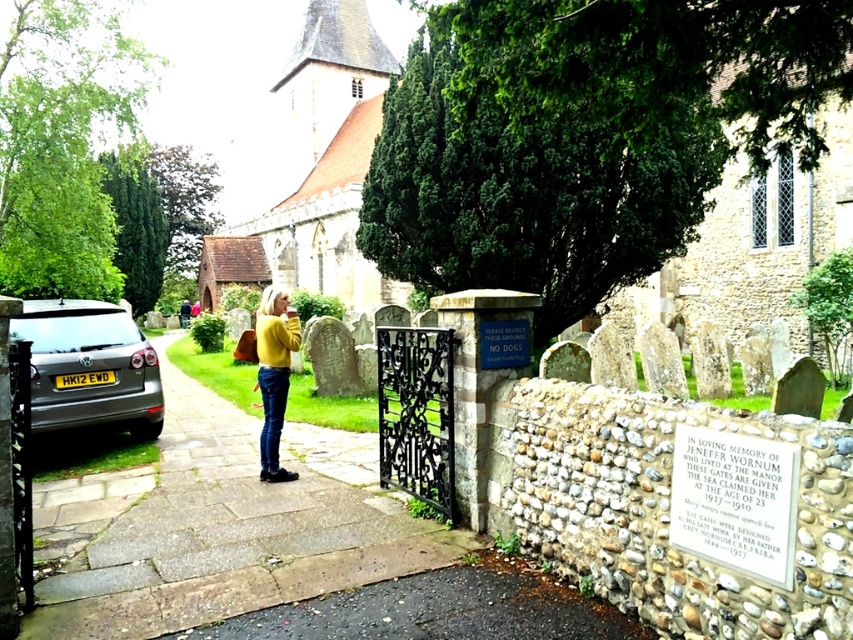
Question: Can you confirm if stone textured church at center is positioned above yellow knitwear at center?

Choices:
 (A) yes
 (B) no

Answer: (A)

Question: Can you confirm if stone textured church at center is wider than yellow knitwear at center?

Choices:
 (A) no
 (B) yes

Answer: (B)

Question: Among these objects, which one is nearest to the camera?

Choices:
 (A) yellow knitwear at center
 (B) stone textured church at center

Answer: (A)

Question: Considering the relative positions of stone textured church at center and yellow knitwear at center in the image provided, where is stone textured church at center located with respect to yellow knitwear at center?

Choices:
 (A) right
 (B) left

Answer: (A)

Question: Which object is positioned farthest from the silver metallic car at left?

Choices:
 (A) yellow knitwear at center
 (B) stone textured church at center

Answer: (B)

Question: Which object appears closest to the camera in this image?

Choices:
 (A) silver metallic car at left
 (B) yellow knitwear at center

Answer: (B)